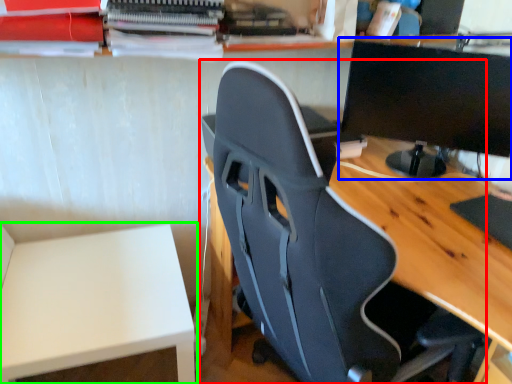
Question: Considering the real-world distances, which object is closest to chair (highlighted by a red box)? computer monitor (highlighted by a blue box) or table (highlighted by a green box).

Choices:
 (A) computer monitor
 (B) table

Answer: (B)